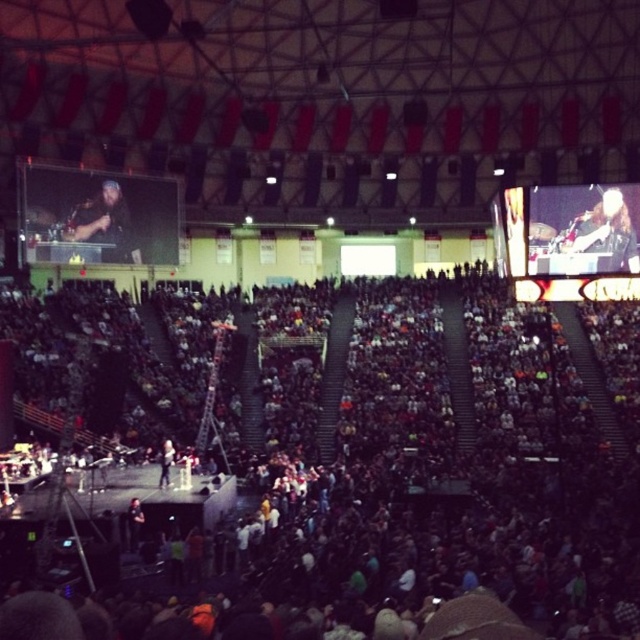
Can you confirm if dark gray crowd at center is bigger than light brown leather jacket at center?

Yes, dark gray crowd at center is bigger than light brown leather jacket at center.

Who is positioned more to the left, dark gray crowd at center or light brown leather jacket at center?

Positioned to the left is light brown leather jacket at center.

Is point (612, 624) more distant than point (163, 472)?

No, (612, 624) is closer to viewer.

The height and width of the screenshot is (640, 640). I want to click on dark gray crowd at center, so click(438, 474).

Who is taller, shiny silver guitar at upper right or light brown leather jacket at center?

With more height is shiny silver guitar at upper right.

Does shiny silver guitar at upper right appear on the right side of light brown leather jacket at center?

Yes, shiny silver guitar at upper right is to the right of light brown leather jacket at center.

Does point (612, 211) come behind point (166, 442)?

That is True.

In order to click on shiny silver guitar at upper right in this screenshot , I will do `click(608, 230)`.

Is matte black screen at upper left thinner than shiny silver guitar at upper right?

No, matte black screen at upper left is not thinner than shiny silver guitar at upper right.

The image size is (640, 640). What do you see at coordinates (97, 216) in the screenshot?
I see `matte black screen at upper left` at bounding box center [97, 216].

Does point (65, 193) lie behind point (625, 269)?

Yes, point (65, 193) is farther from viewer.

You are a GUI agent. You are given a task and a screenshot of the screen. Output one action in this format:
    pyautogui.click(x=<x>, y=<y>)
    Task: Click on the matte black screen at upper left
    This screenshot has height=640, width=640.
    Given the screenshot: What is the action you would take?
    pyautogui.click(x=97, y=216)